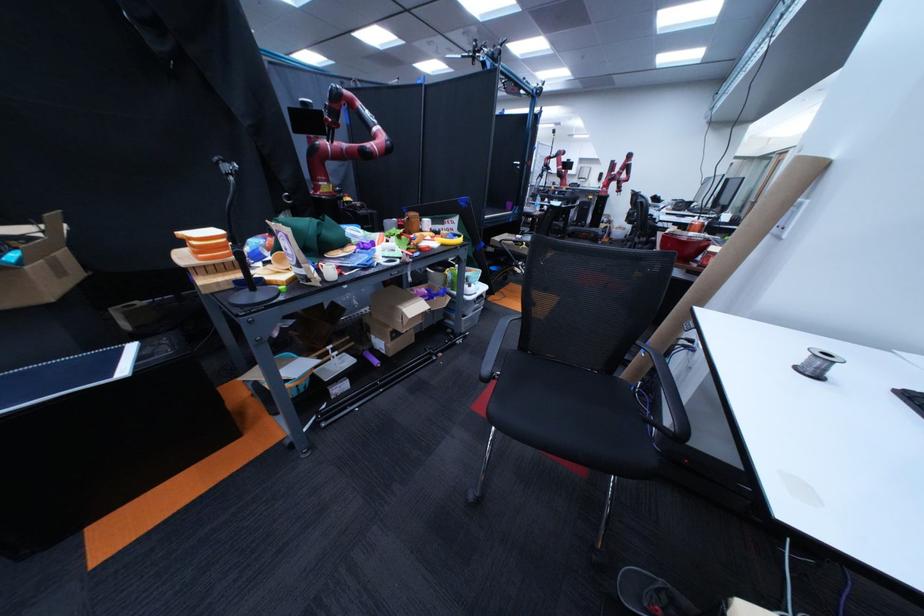
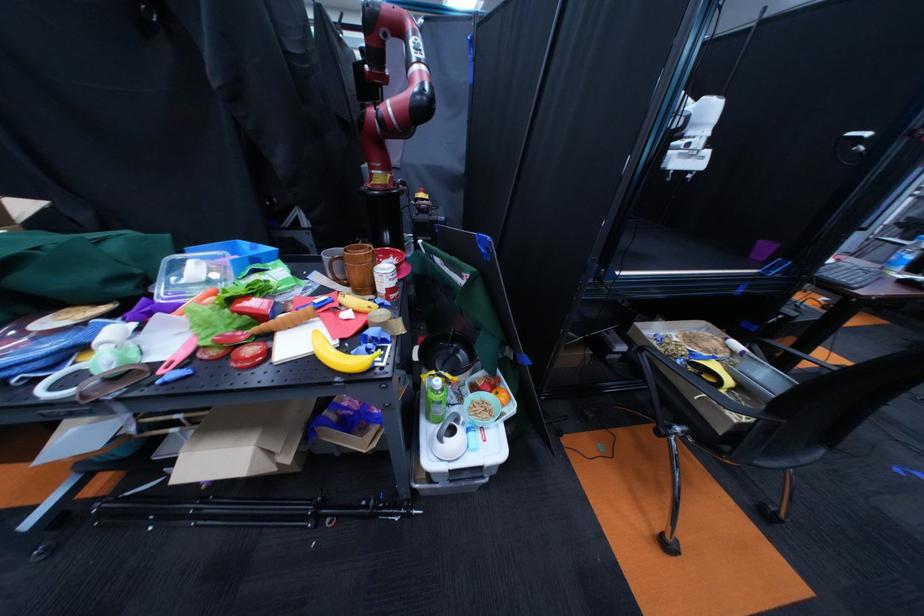
Locate, in the second image, the point that corresponds to point (558, 291) in the first image.

(776, 517)